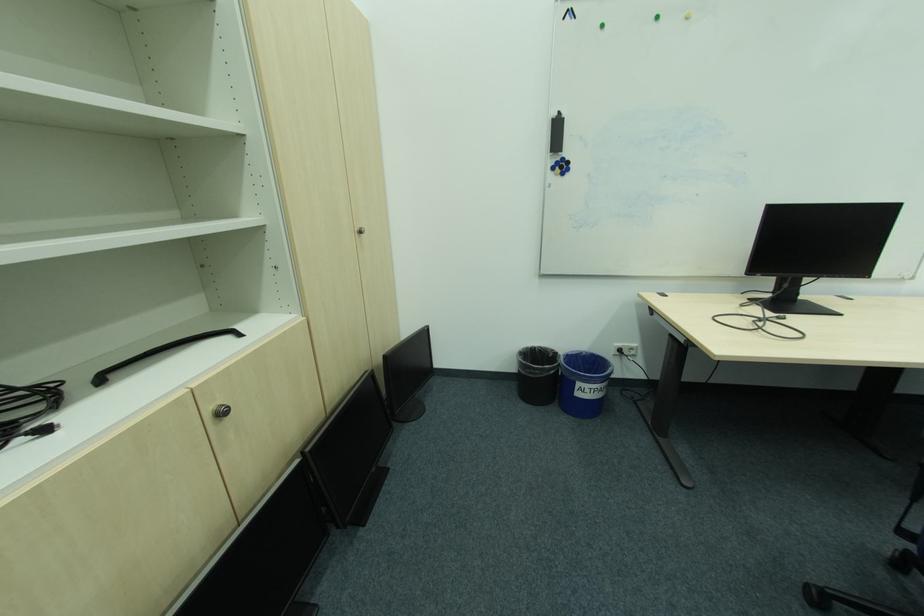
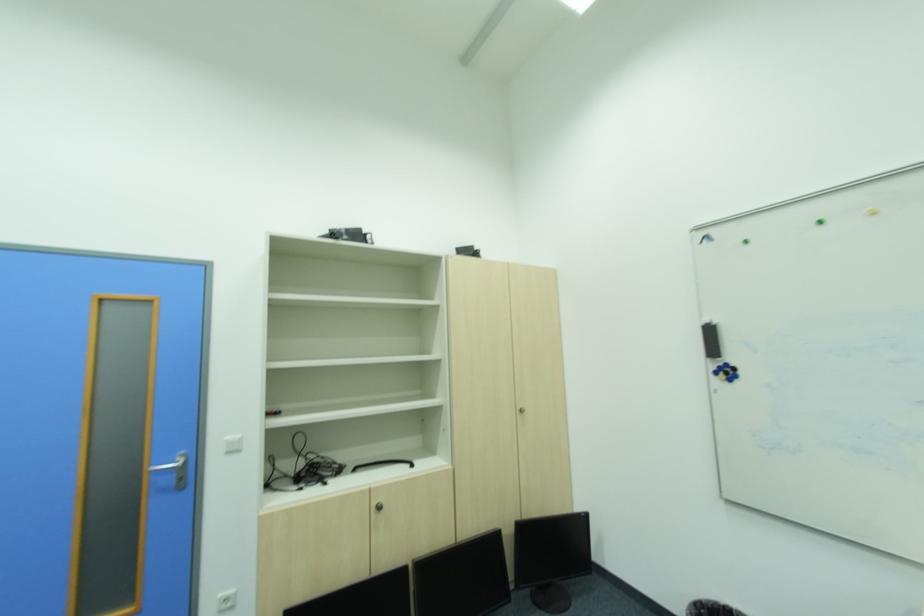
Locate, in the second image, the point that corresponds to the point at 569,167 in the first image.

(736, 371)